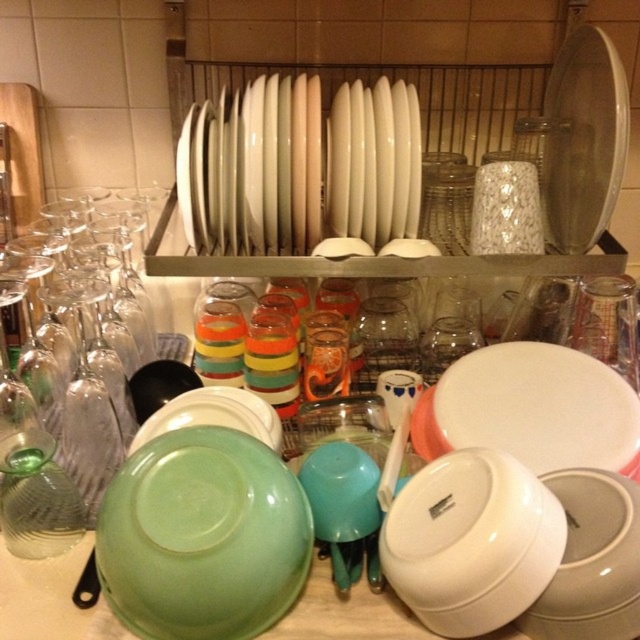
Measure the distance between white glossy plates at center and camera.

A distance of 29.17 inches exists between white glossy plates at center and camera.

Is point (240, 241) farther from camera compared to point (252, 426)?

Yes.

Does point (276, 218) come in front of point (257, 397)?

No, (276, 218) is behind (257, 397).

I want to click on white glossy plates at center, so click(x=250, y=170).

Is point (124, 320) more distant than point (598, 56)?

Yes, it is.

Between point (106, 467) and point (595, 224), which one is positioned behind?

The point (595, 224) is more distant.

Measure the distance between point (108, 428) and camera.

29.13 inches

I want to click on transparent glass wine glass at left, so click(x=100, y=362).

Does point (124, 493) come farther from viewer compared to point (547, 205)?

That is False.

In the scene shown: Does green matte bowl at lower left appear on the left side of transparent glass plate at upper right?

Correct, you'll find green matte bowl at lower left to the left of transparent glass plate at upper right.

Is point (157, 449) closer to camera compared to point (625, 156)?

Yes, it is in front of point (625, 156).

Locate an element on the screen. This screenshot has width=640, height=640. green matte bowl at lower left is located at coordinates (202, 536).